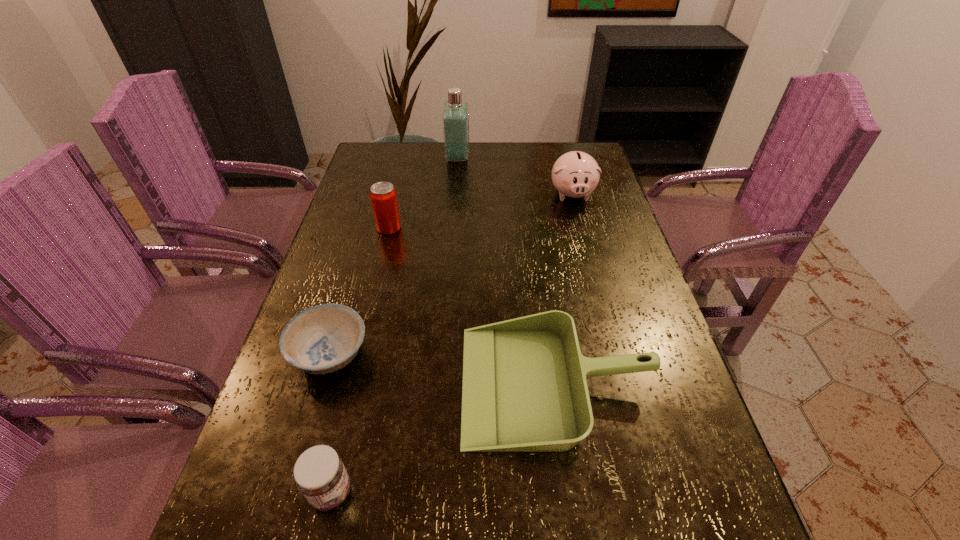
Identify the location of vacant space located on the front label of the jam. This screenshot has width=960, height=540. (382, 492).

The width and height of the screenshot is (960, 540). I want to click on free region located 0.230m on the scoop of the dustpan, so click(349, 384).

Where is `free space located 0.050m on the scoop of the dustpan`? This screenshot has width=960, height=540. free space located 0.050m on the scoop of the dustpan is located at coordinates (438, 384).

Locate an element on the screen. This screenshot has height=540, width=960. free location located 0.200m on the scoop of the dustpan is located at coordinates (365, 384).

What are the coordinates of `blank space located on the right of the bowl` in the screenshot? It's located at (486, 354).

Where is `object at the far edge`? Image resolution: width=960 pixels, height=540 pixels. object at the far edge is located at coordinates (455, 118).

Locate an element on the screen. can situated at the left edge is located at coordinates (383, 196).

You are a GUI agent. You are given a task and a screenshot of the screen. Output one action in this format:
    pyautogui.click(x=<x>, y=<y>)
    Task: Click on the jam at the left edge
    Image resolution: width=960 pixels, height=540 pixels.
    Given the screenshot: What is the action you would take?
    pyautogui.click(x=319, y=472)

I want to click on bowl at the left edge, so click(x=322, y=339).

At what (x,y) coordinates should I click in order to perform the action: click on piggy bank located in the right edge section of the desktop. Please return your answer as a coordinate pair (x, y). This screenshot has width=960, height=540. Looking at the image, I should click on (575, 174).